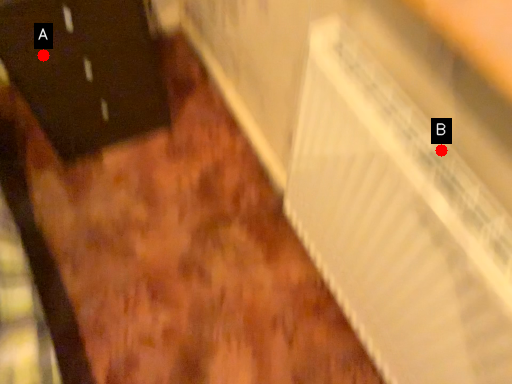
Question: Two points are circled on the image, labeled by A and B beside each circle. Which of the following is the farthest from the observer?

Choices:
 (A) A is further
 (B) B is further

Answer: (A)